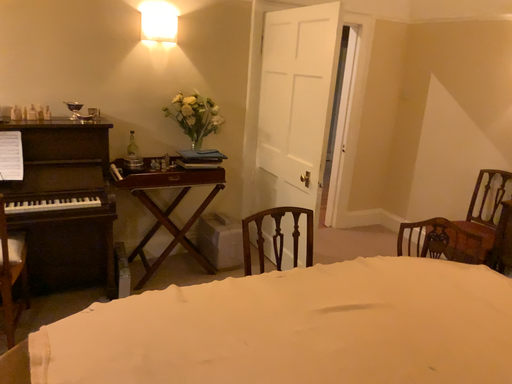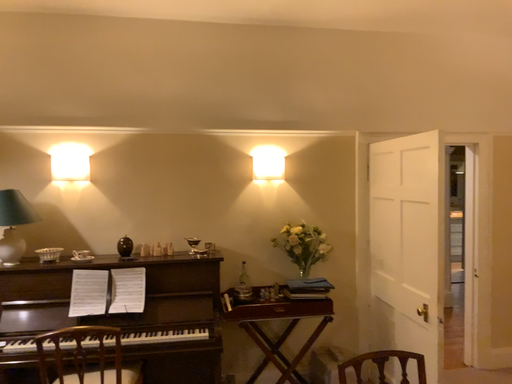
Question: Which way did the camera rotate in the video?

Choices:
 (A) rotated left
 (B) rotated right

Answer: (A)